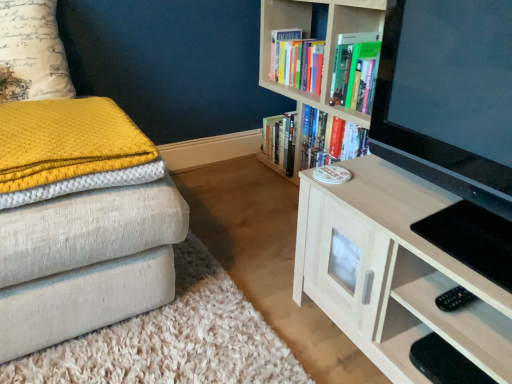
Where is `free point above light wood cabinet at center, which appears as the second bookcase when viewed from the back (from a real-world perspective)`? free point above light wood cabinet at center, which appears as the second bookcase when viewed from the back (from a real-world perspective) is located at coordinates (420, 206).